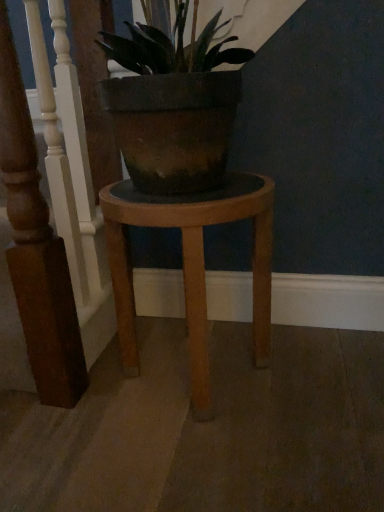
Find the location of a particular element. This screenshot has height=512, width=384. vacant region to the right of wooden stool at center is located at coordinates (321, 375).